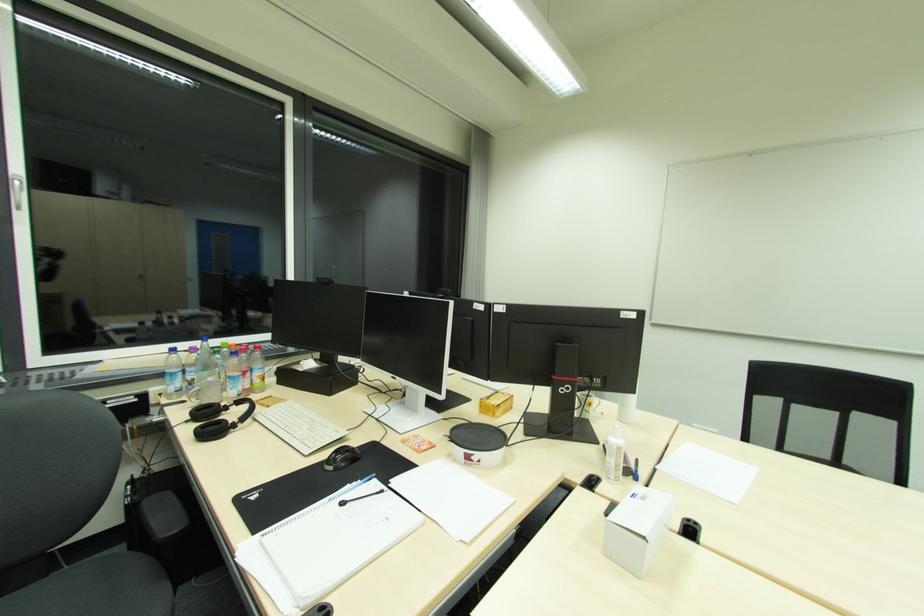
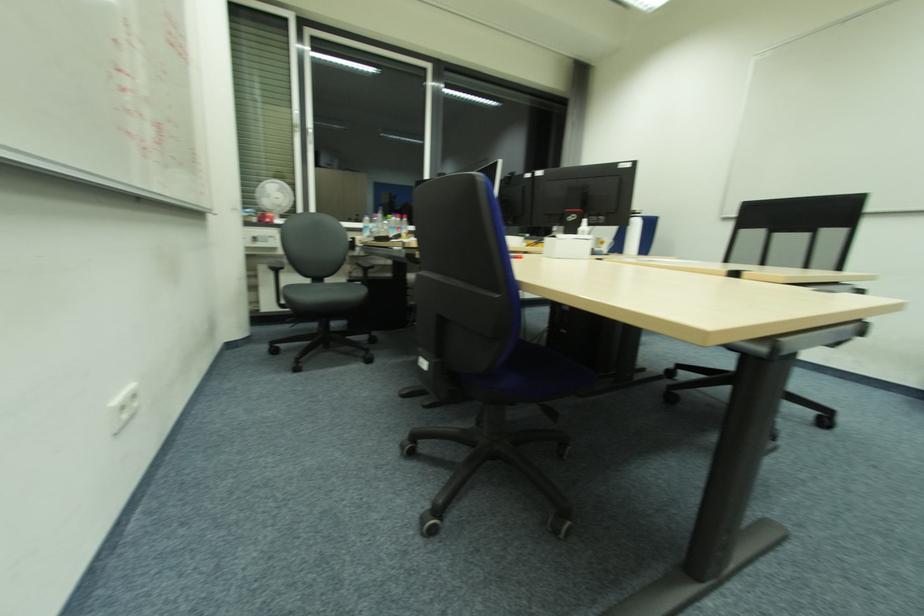
Consider the image. The images are taken continuously from a first-person perspective. In which direction are you moving?

The movement direction of the cameraman is right, backward.